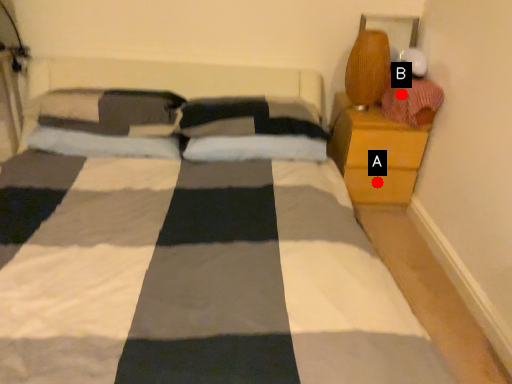
Question: Two points are circled on the image, labeled by A and B beside each circle. Which point is further to the camera?

Choices:
 (A) A is further
 (B) B is further

Answer: (A)